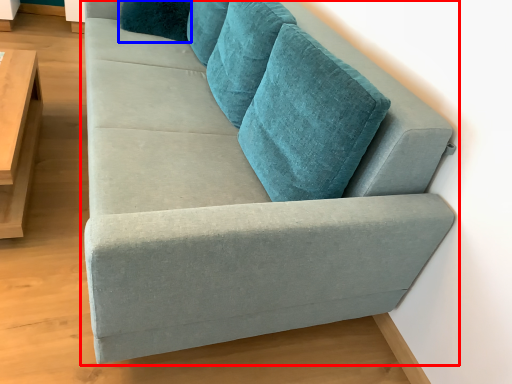
Question: Which point is closer to the camera, studio couch (highlighted by a red box) or pillow (highlighted by a blue box)?

Choices:
 (A) studio couch
 (B) pillow

Answer: (A)